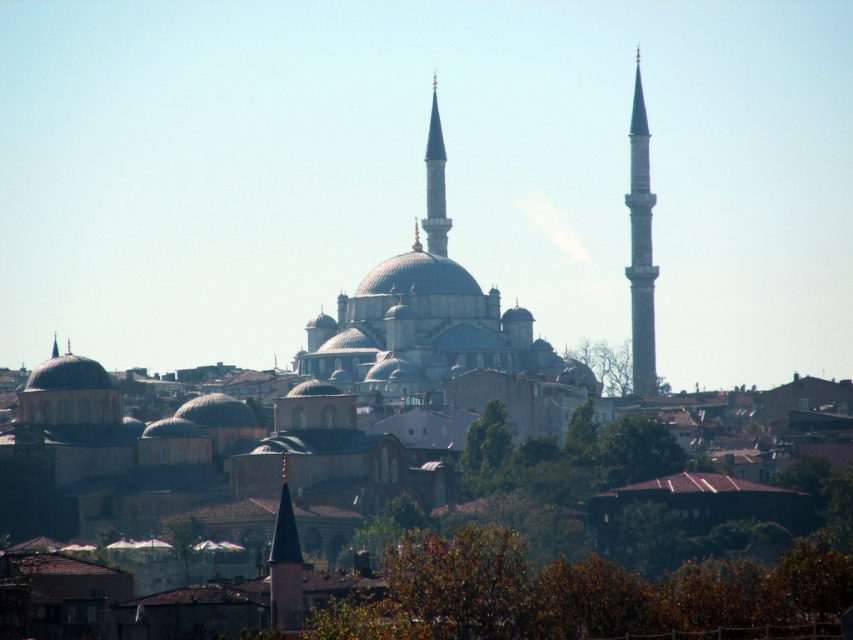
Question: Can you confirm if smooth gray minaret at right is smaller than white marble minaret at center?

Choices:
 (A) no
 (B) yes

Answer: (A)

Question: Which of the following is the closest to the observer?

Choices:
 (A) (438, 140)
 (B) (653, 371)

Answer: (B)

Question: Where is smooth gray minaret at right located in relation to white marble minaret at center in the image?

Choices:
 (A) below
 (B) above

Answer: (A)

Question: Is smooth gray minaret at right to the left of white marble minaret at center from the viewer's perspective?

Choices:
 (A) yes
 (B) no

Answer: (B)

Question: Which point is closer to the camera taking this photo?

Choices:
 (A) (434, 136)
 (B) (640, 176)

Answer: (B)